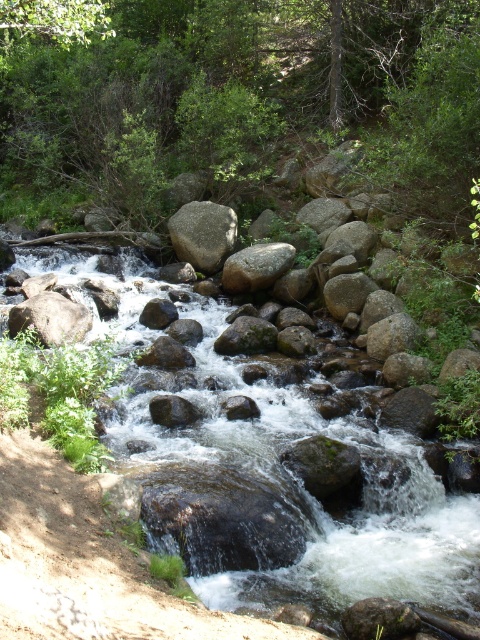
You are standing at the edge of the stream in the forest scene. There is a smooth rock stream at center marked by point (241, 476). If you want to cross the stream to the other side, would you be able to step on the smooth rock stream at center?

The smooth rock stream at center is represented by point (241, 476), so stepping on it would be possible as it indicates the presence of a rock in the stream that you can use to cross.

You are a hiker who wants to cross the stream. You see the smooth rock stream at center and the gray rock at center. Which rock is taller, making it easier to step on?

The gray rock at center is taller than the smooth rock stream at center, so it would be easier to step on.